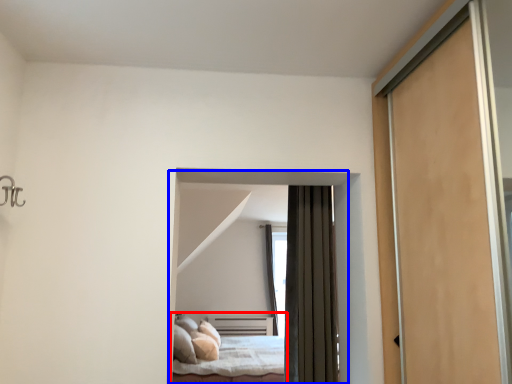
Question: Which of the following is the farthest to the observer, bed (highlighted by a red box) or bed (highlighted by a blue box)?

Choices:
 (A) bed
 (B) bed

Answer: (A)